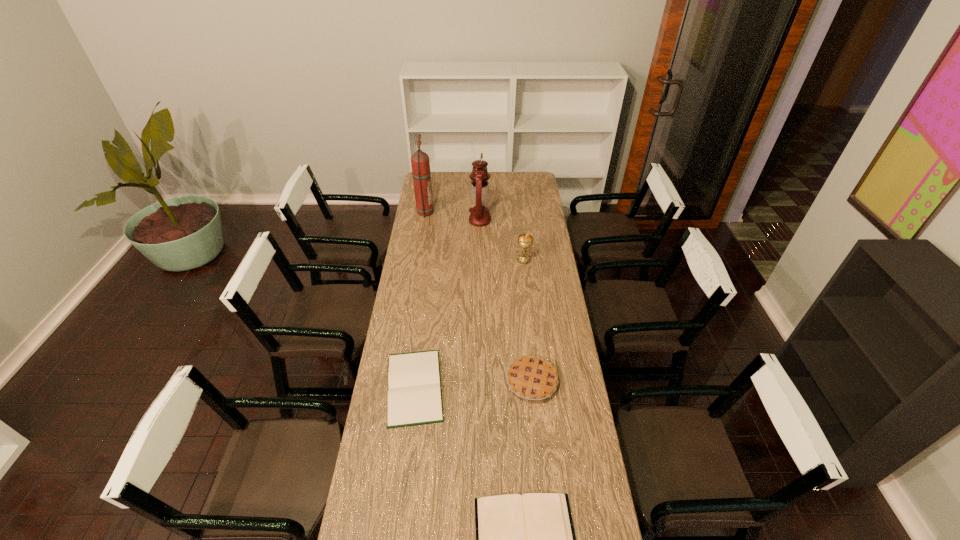
Image resolution: width=960 pixels, height=540 pixels. Find the location of `blank area located 0.150m on the front of the farther hardback book`. blank area located 0.150m on the front of the farther hardback book is located at coordinates (404, 471).

Identify the location of fire extinguisher at the left edge. This screenshot has height=540, width=960. (420, 163).

I want to click on hardback book present at the left edge, so click(x=414, y=397).

Locate an element on the screen. This screenshot has height=540, width=960. chalice at the right edge is located at coordinates (525, 241).

Identify the location of pie at the right edge. point(530,377).

You are a GUI agent. You are given a task and a screenshot of the screen. Output one action in this format:
    pyautogui.click(x=<x>, y=<y>)
    Task: Click on the vacant region at the far edge of the desktop
    
    Given the screenshot: What is the action you would take?
    pyautogui.click(x=446, y=175)

At what (x,y) coordinates should I click in order to perform the action: click on free space at the left edge of the desktop. Please return your answer as a coordinate pair (x, y). This screenshot has width=960, height=540. Looking at the image, I should click on (434, 278).

At what (x,y) coordinates should I click in order to perform the action: click on blank area at the right edge. Please return your answer as a coordinate pair (x, y). The height and width of the screenshot is (540, 960). Looking at the image, I should click on (564, 313).

Identify the location of vacant space at the far left corner of the desktop. The height and width of the screenshot is (540, 960). (438, 177).

Identify the location of free region at the far right corner of the desktop. The image size is (960, 540). (535, 184).